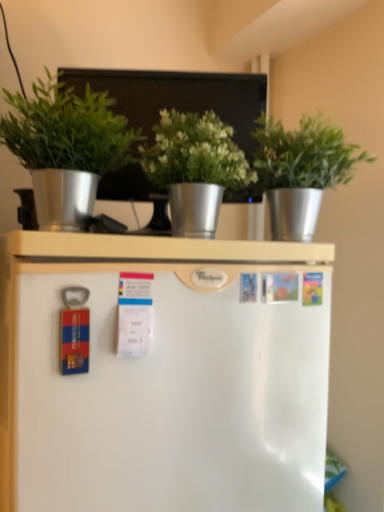
Question: Does metallic silver bulletin board at upper center contain metallic silver pot at upper center, which is the 1th houseplant in right-to-left order?

Choices:
 (A) no
 (B) yes

Answer: (A)

Question: From a real-world perspective, does metallic silver bulletin board at upper center sit lower than metallic silver pot at upper center, which is the 1th houseplant in right-to-left order?

Choices:
 (A) no
 (B) yes

Answer: (A)

Question: Is metallic silver bulletin board at upper center shorter than metallic silver pot at upper center, which is the 1th houseplant in right-to-left order?

Choices:
 (A) yes
 (B) no

Answer: (B)

Question: Considering the relative sizes of metallic silver bulletin board at upper center and metallic silver pot at upper center, which is the 1th houseplant in right-to-left order, in the image provided, is metallic silver bulletin board at upper center wider than metallic silver pot at upper center, which is the 1th houseplant in right-to-left order,?

Choices:
 (A) yes
 (B) no

Answer: (B)

Question: Is metallic silver bulletin board at upper center at the right side of metallic silver pot at upper center, which is the 3th houseplant from left to right?

Choices:
 (A) yes
 (B) no

Answer: (B)

Question: Considering the positions of metallic silver bulletin board at upper center and green metallic pot at center, which is the 2th houseplant from right to left, in the image, is metallic silver bulletin board at upper center bigger or smaller than green metallic pot at center, which is the 2th houseplant from right to left,?

Choices:
 (A) big
 (B) small

Answer: (A)

Question: Is metallic silver bulletin board at upper center inside the boundaries of green metallic pot at center, which is the 2th houseplant from right to left, or outside?

Choices:
 (A) inside
 (B) outside

Answer: (B)

Question: From a real-world perspective, is metallic silver bulletin board at upper center positioned above or below green metallic pot at center, placed as the second houseplant when sorted from left to right?

Choices:
 (A) below
 (B) above

Answer: (B)

Question: Is metallic silver bulletin board at upper center to the left or to the right of green metallic pot at center, which is the 2th houseplant from right to left, in the image?

Choices:
 (A) right
 (B) left

Answer: (B)

Question: From a real-world perspective, is metallic silver pot at upper center, which is the 3th houseplant from left to right, above or below green matte plant at upper left, arranged as the 1th houseplant when viewed from the left?

Choices:
 (A) below
 (B) above

Answer: (B)

Question: From the image's perspective, relative to green matte plant at upper left, arranged as the 1th houseplant when viewed from the left, is metallic silver pot at upper center, which is the 1th houseplant in right-to-left order, above or below?

Choices:
 (A) above
 (B) below

Answer: (B)

Question: Which is correct: metallic silver pot at upper center, which is the 1th houseplant in right-to-left order, is inside green matte plant at upper left, the 3th houseplant when ordered from right to left, or outside of it?

Choices:
 (A) inside
 (B) outside

Answer: (B)

Question: In terms of height, does metallic silver pot at upper center, which is the 3th houseplant from left to right, look taller or shorter compared to green matte plant at upper left, arranged as the 1th houseplant when viewed from the left?

Choices:
 (A) tall
 (B) short

Answer: (A)

Question: Looking at the image, does green matte plant at upper left, arranged as the 1th houseplant when viewed from the left, seem bigger or smaller compared to green metallic pot at center, placed as the second houseplant when sorted from left to right?

Choices:
 (A) small
 (B) big

Answer: (B)

Question: Visually, is green matte plant at upper left, arranged as the 1th houseplant when viewed from the left, positioned to the left or to the right of green metallic pot at center, placed as the second houseplant when sorted from left to right?

Choices:
 (A) right
 (B) left

Answer: (B)